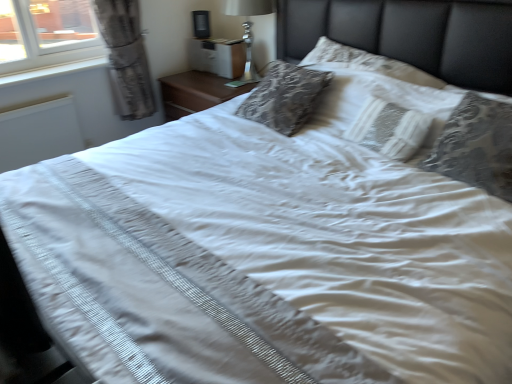
Where is `free space above white matte radiator at left (from a real-world perspective)`? This screenshot has height=384, width=512. free space above white matte radiator at left (from a real-world perspective) is located at coordinates (29, 106).